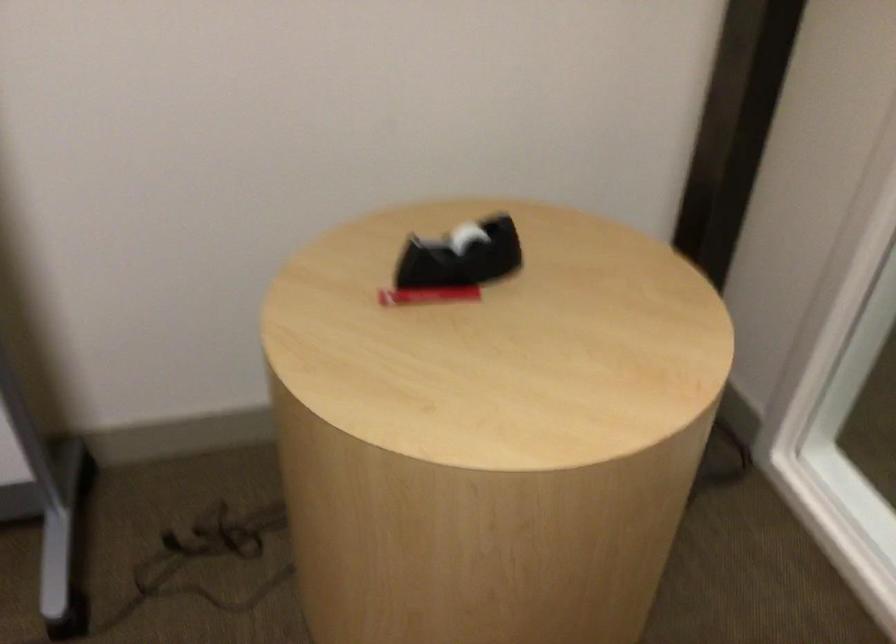
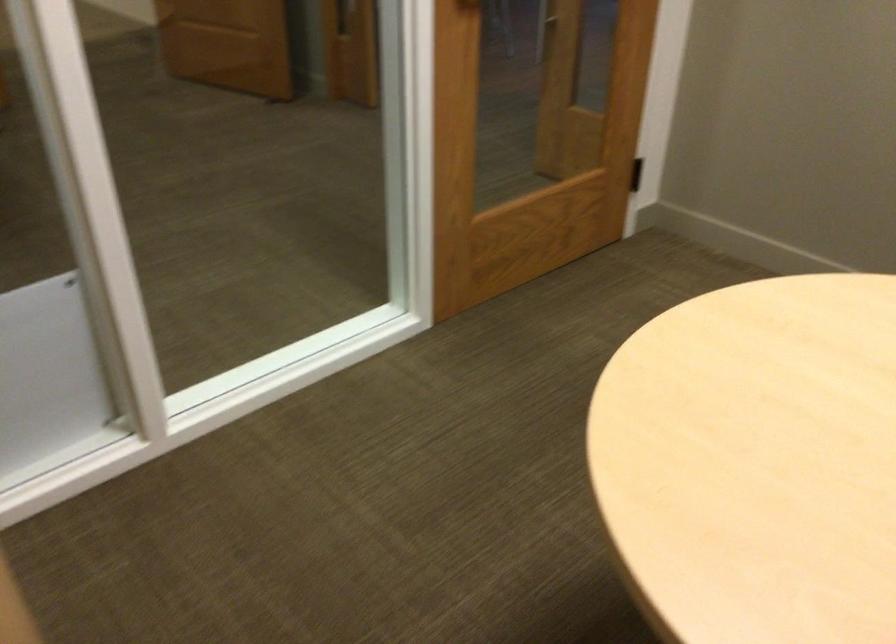
First-person continuous shooting, in which direction is the camera rotating?

The camera's rotation is toward right-down.